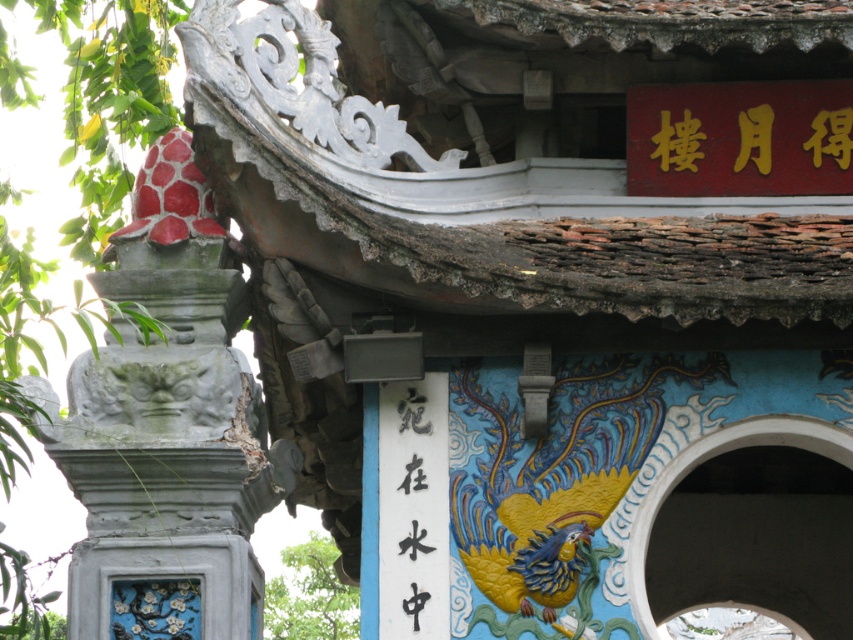
Question: Considering the real-world distances, which object is closest to the smooth gray stone pillar at left?

Choices:
 (A) blue painted stone arch at center
 (B) black paper at center

Answer: (B)

Question: Is smooth gray stone pillar at left thinner than black paper at center?

Choices:
 (A) yes
 (B) no

Answer: (B)

Question: Is the position of smooth gray stone pillar at left more distant than that of black paper at center?

Choices:
 (A) no
 (B) yes

Answer: (A)

Question: Can you confirm if blue painted stone arch at center is thinner than black paper at center?

Choices:
 (A) yes
 (B) no

Answer: (A)

Question: Which point appears farthest from the camera in this image?

Choices:
 (A) (817, 448)
 (B) (413, 532)
 (C) (200, 499)

Answer: (A)

Question: Which point appears closest to the camera in this image?

Choices:
 (A) (703, 458)
 (B) (399, 486)
 (C) (97, 596)

Answer: (C)